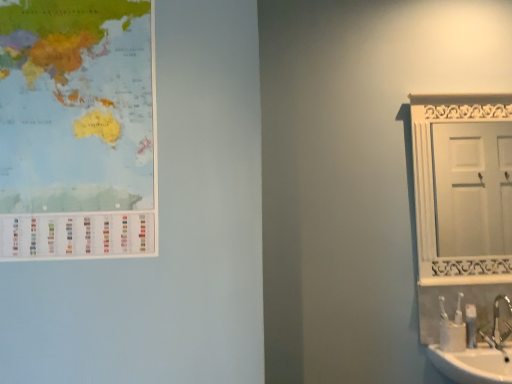
Question: Relative to silver metallic faucet at lower right, is white plastic toothbrush at lower right in front or behind?

Choices:
 (A) behind
 (B) front

Answer: (A)

Question: Is white plastic toothbrush at lower right taller or shorter than silver metallic faucet at lower right?

Choices:
 (A) tall
 (B) short

Answer: (B)

Question: Estimate the real-world distances between objects in this image. Which object is closer to the silver metallic faucet at lower right?

Choices:
 (A) white wooden door at right
 (B) white plastic toothbrush at lower right
 (C) matte paper map at upper left

Answer: (B)

Question: Which object is the closest to the white wooden door at right?

Choices:
 (A) matte paper map at upper left
 (B) white plastic toothbrush at lower right
 (C) silver metallic faucet at lower right

Answer: (C)